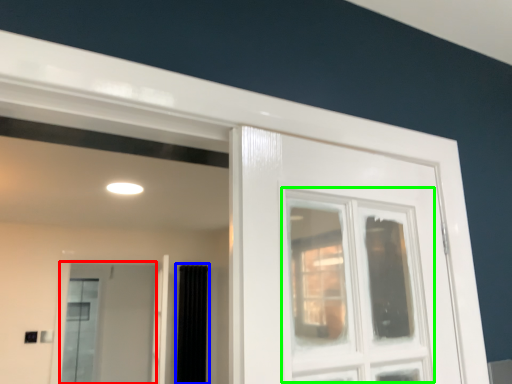
Question: Based on their relative distances, which object is nearer to screen door (highlighted by a red box)? Choose from curtain (highlighted by a blue box) and window (highlighted by a green box).

Choices:
 (A) curtain
 (B) window

Answer: (A)